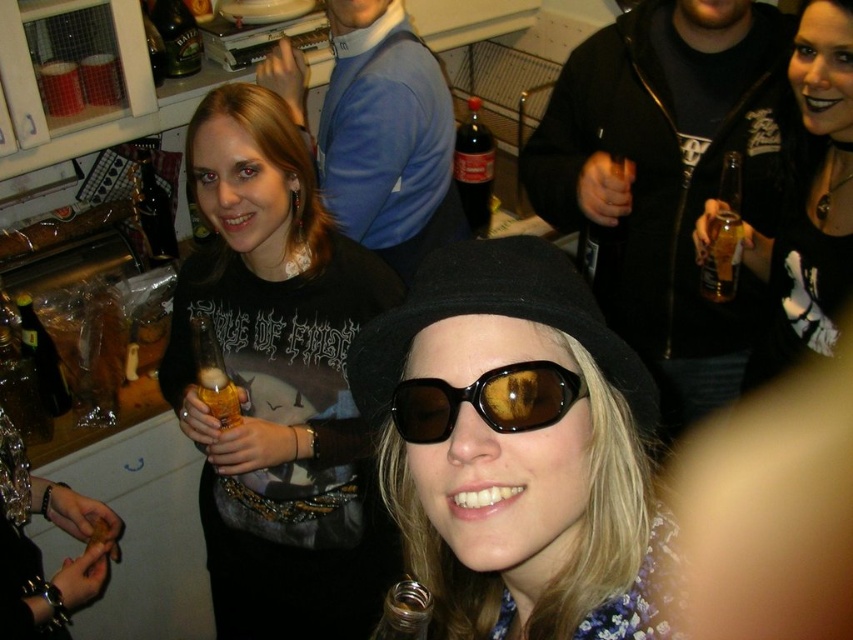
Question: Does black leather jacket at upper right lie behind clear glass bottle at center?

Choices:
 (A) yes
 (B) no

Answer: (A)

Question: Which point is farther from the camera taking this photo?

Choices:
 (A) (352, 522)
 (B) (567, 394)

Answer: (A)

Question: Which of the following is the farthest from the observer?

Choices:
 (A) translucent plastic bottle at center
 (B) brown reflective sunglasses at center
 (C) clear glass bottle at center

Answer: (A)

Question: Is the position of dark glass coca-cola at center more distant than that of translucent plastic bottle at center?

Choices:
 (A) no
 (B) yes

Answer: (B)

Question: Does clear glass bottle at upper right have a smaller size compared to clear glass bottle at center?

Choices:
 (A) yes
 (B) no

Answer: (B)

Question: Which point is farther to the camera?

Choices:
 (A) (212, 371)
 (B) (456, 502)

Answer: (A)